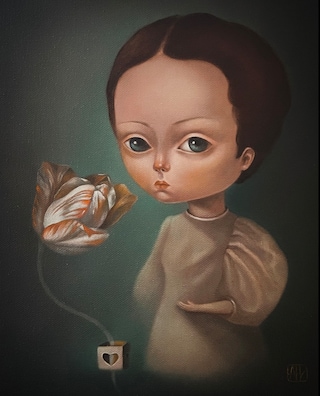
Identify the location of box with heart cutout. (105, 349), (109, 357).